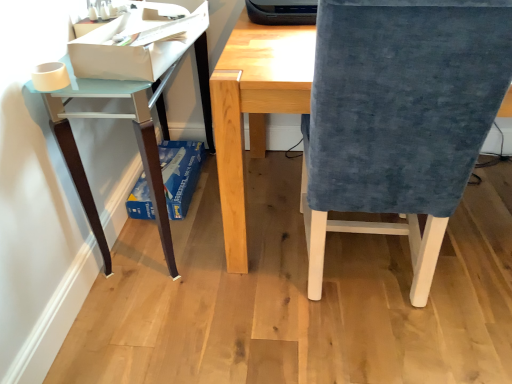
Question: Are velvet blue chair at right and light blue glossy table at left beside each other?

Choices:
 (A) yes
 (B) no

Answer: (B)

Question: Is velvet blue chair at right bigger than light blue glossy table at left?

Choices:
 (A) yes
 (B) no

Answer: (A)

Question: From the image's perspective, is velvet blue chair at right located beneath light blue glossy table at left?

Choices:
 (A) yes
 (B) no

Answer: (A)

Question: Does velvet blue chair at right come behind light blue glossy table at left?

Choices:
 (A) no
 (B) yes

Answer: (A)

Question: Can you confirm if velvet blue chair at right is thinner than light blue glossy table at left?

Choices:
 (A) no
 (B) yes

Answer: (A)

Question: Does point (426, 208) appear closer or farther from the camera than point (157, 180)?

Choices:
 (A) closer
 (B) farther

Answer: (A)

Question: Visually, is velvet blue chair at right positioned to the left or to the right of light blue glossy table at left?

Choices:
 (A) right
 (B) left

Answer: (A)

Question: From the image's perspective, is velvet blue chair at right positioned above or below light blue glossy table at left?

Choices:
 (A) below
 (B) above

Answer: (A)

Question: In the image, is velvet blue chair at right positioned in front of or behind light blue glossy table at left?

Choices:
 (A) front
 (B) behind

Answer: (A)

Question: From the image's perspective, relative to light blue glossy table at left, is white paper at upper left, which is counted as the 1th paperback book, starting from the top, above or below?

Choices:
 (A) below
 (B) above

Answer: (B)

Question: In the image, is white paper at upper left, arranged as the 1th paperback book when viewed from the front, positioned in front of or behind light blue glossy table at left?

Choices:
 (A) front
 (B) behind

Answer: (A)

Question: Is white paper at upper left, arranged as the 1th paperback book when viewed from the front, situated inside light blue glossy table at left or outside?

Choices:
 (A) inside
 (B) outside

Answer: (B)

Question: From a real-world perspective, is white paper at upper left, arranged as the 1th paperback book when viewed from the front, above or below light blue glossy table at left?

Choices:
 (A) below
 (B) above

Answer: (B)

Question: From the image's perspective, is velvet blue chair at right above or below blue cardboard box at lower left, the first paperback book positioned from the back?

Choices:
 (A) above
 (B) below

Answer: (A)

Question: Considering the positions of velvet blue chair at right and blue cardboard box at lower left, which ranks as the 2th paperback book in top-to-bottom order, in the image, is velvet blue chair at right taller or shorter than blue cardboard box at lower left, which ranks as the 2th paperback book in top-to-bottom order,?

Choices:
 (A) tall
 (B) short

Answer: (A)